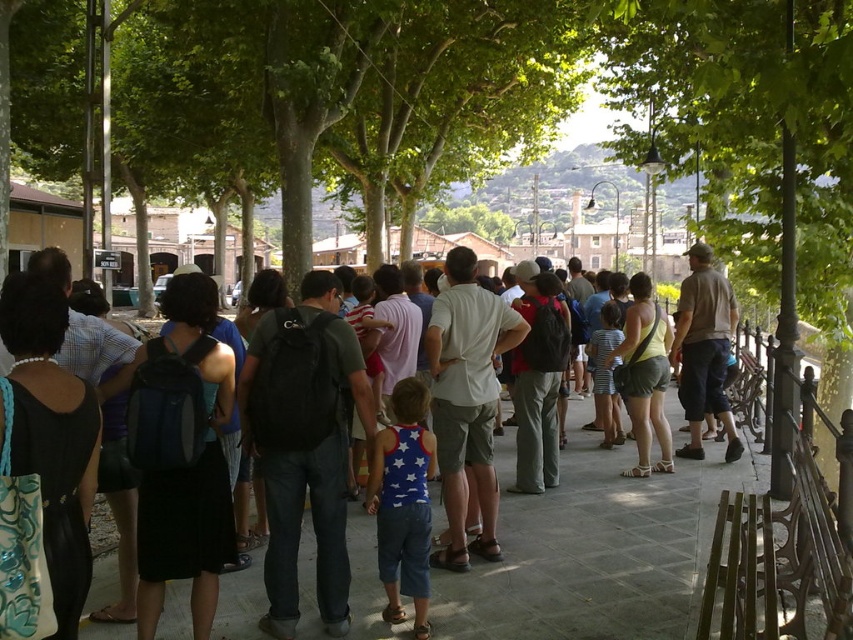
You are standing at the origin point of the image coordinate system. Where is the khaki cotton shirt at center located in terms of coordinates?

The khaki cotton shirt at center is located at coordinates point (704, 349).

You are standing at the point closer to the camera in the image. Which point are you at, point (722, 289) or point (643, 356)?

You are at point (722, 289) because it is further to the camera than point (643, 356).